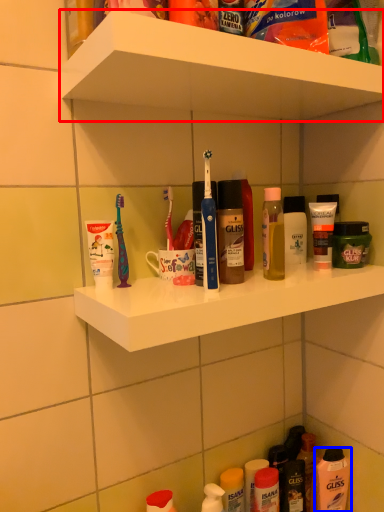
Question: Which object is further to the camera taking this photo, supermarket shelf (highlighted by a red box) or mouthwash (highlighted by a blue box)?

Choices:
 (A) supermarket shelf
 (B) mouthwash

Answer: (B)